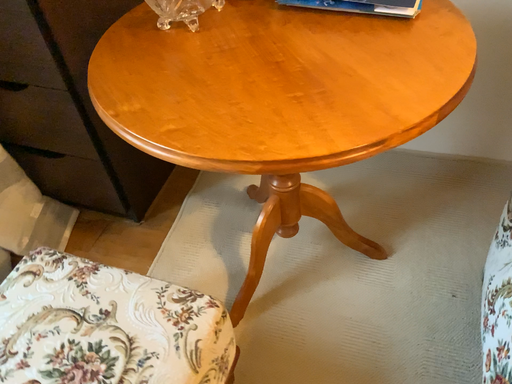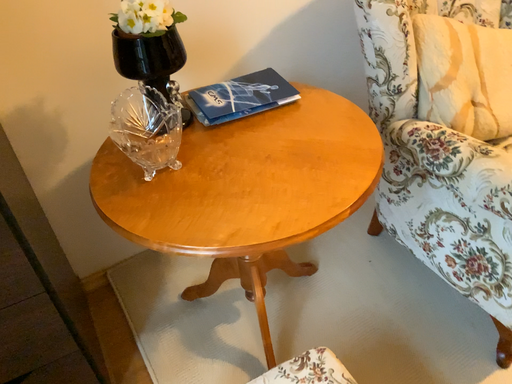
Question: Which way did the camera rotate in the video?

Choices:
 (A) rotated upward
 (B) rotated downward

Answer: (A)